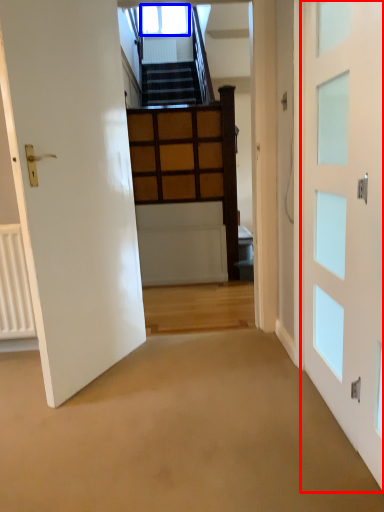
Question: Which of the following is the closest to the observer, door (highlighted by a red box) or window (highlighted by a blue box)?

Choices:
 (A) door
 (B) window

Answer: (A)